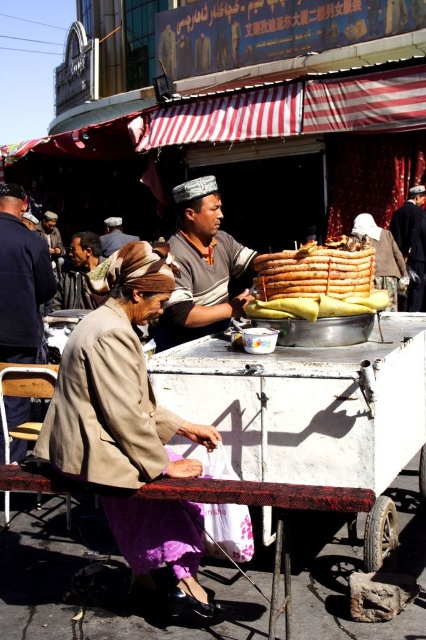
Find the location of a particular element. The width and height of the screenshot is (426, 640). golden brown bread at center is located at coordinates pyautogui.click(x=316, y=282).

Is golden brown bread at center bigger than brown leather hat at center?

Incorrect, golden brown bread at center is not larger than brown leather hat at center.

Is point (314, 296) more distant than point (106, 220)?

No, it is in front of (106, 220).

The width and height of the screenshot is (426, 640). What are the coordinates of `golden brown bread at center` in the screenshot? It's located at (316, 282).

How distant is brown cotton shirt at center from brown leather jacket at lower left?

A distance of 4.52 feet exists between brown cotton shirt at center and brown leather jacket at lower left.

Based on the photo, can you confirm if brown cotton shirt at center is positioned below brown leather jacket at lower left?

Indeed, brown cotton shirt at center is positioned under brown leather jacket at lower left.

This screenshot has height=640, width=426. What are the coordinates of `brown cotton shirt at center` in the screenshot? It's located at (201, 268).

The image size is (426, 640). What do you see at coordinates (313, 416) in the screenshot? I see `white matte cart at center` at bounding box center [313, 416].

Is white matte cart at center wider than beige fabric jacket at center?

Yes.

Which is behind, point (249, 412) or point (143, 396)?

Positioned behind is point (249, 412).

At what (x,y) coordinates should I click in order to perform the action: click on white matte cart at center. Please return your answer as a coordinate pair (x, y). This screenshot has height=640, width=426. Looking at the image, I should click on (313, 416).